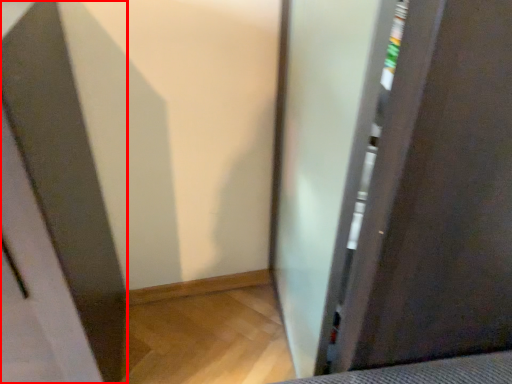
Question: Observing the image, what is the correct spatial positioning of screen door (annotated by the red box) in reference to screen door?

Choices:
 (A) left
 (B) right

Answer: (A)